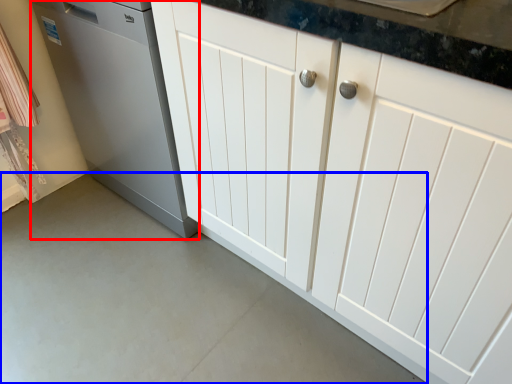
Question: Among these objects, which one is farthest to the camera, home appliance (highlighted by a red box) or concrete (highlighted by a blue box)?

Choices:
 (A) home appliance
 (B) concrete

Answer: (A)